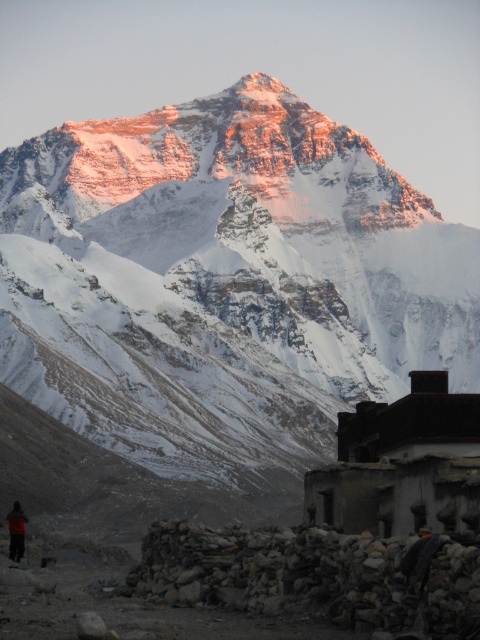
Question: Is snowy rock mountain at center to the right of rustic stone hut at lower right from the viewer's perspective?

Choices:
 (A) yes
 (B) no

Answer: (B)

Question: Is snowy rock mountain at center above orange fabric jacket at lower left?

Choices:
 (A) no
 (B) yes

Answer: (B)

Question: Can you confirm if snowy rock mountain at center is smaller than orange fabric jacket at lower left?

Choices:
 (A) no
 (B) yes

Answer: (A)

Question: Which of the following is the farthest from the observer?

Choices:
 (A) (433, 323)
 (B) (21, 509)

Answer: (A)

Question: Which point is closer to the camera?

Choices:
 (A) rustic stone hut at lower right
 (B) orange fabric jacket at lower left

Answer: (A)

Question: Which point is closer to the camera?

Choices:
 (A) orange fabric jacket at lower left
 (B) rustic stone hut at lower right

Answer: (B)